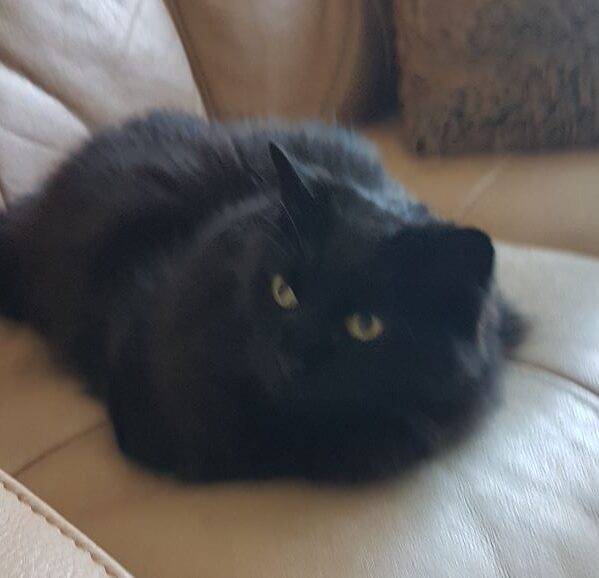
Where is `throw pillow in back`? The width and height of the screenshot is (599, 578). throw pillow in back is located at coordinates (534, 72).